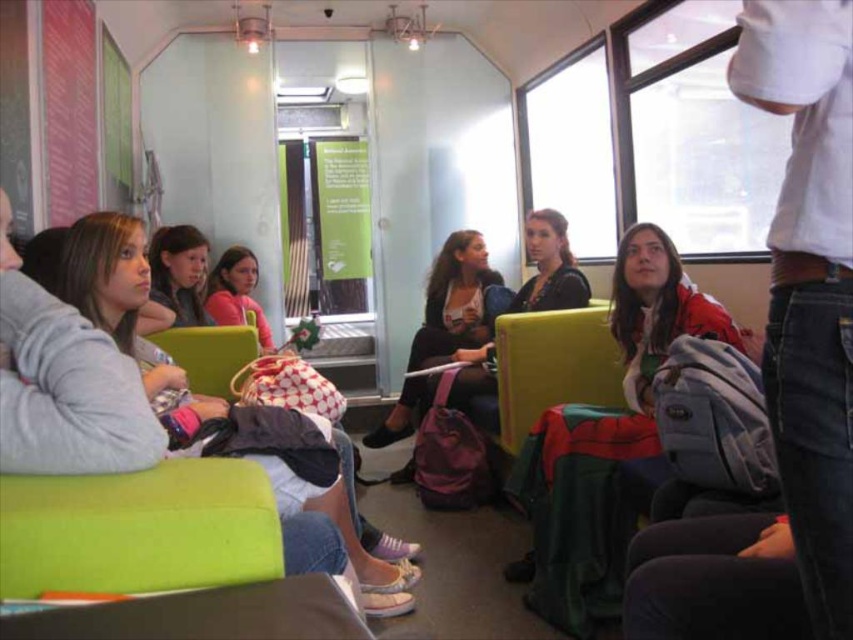
Is matte black backpack at center above matte green chair at center?

Yes.

Does matte black backpack at center appear under matte green chair at center?

Actually, matte black backpack at center is above matte green chair at center.

Who is more distant from viewer, (444, 296) or (202, 384)?

Positioned behind is point (444, 296).

Locate an element on the screen. matte black backpack at center is located at coordinates (457, 305).

Between point (154, 284) and point (196, 372), which one is positioned behind?

The point (154, 284) is behind.

Between point (181, 285) and point (241, 328), which one is positioned in front?

Point (241, 328) is in front.

Find the location of a particular element. This screenshot has width=853, height=640. matte black jacket at upper left is located at coordinates (177, 275).

Who is lower down, matte gray hoodie at left or matte black backpack at center?

matte gray hoodie at left is below.

Between matte gray hoodie at left and matte black backpack at center, which one appears on the right side from the viewer's perspective?

Positioned to the right is matte black backpack at center.

Image resolution: width=853 pixels, height=640 pixels. What do you see at coordinates (114, 285) in the screenshot?
I see `matte gray hoodie at left` at bounding box center [114, 285].

You are a GUI agent. You are given a task and a screenshot of the screen. Output one action in this format:
    pyautogui.click(x=<x>, y=<y>)
    Task: Click on the matte gray hoodie at left
    
    Given the screenshot: What is the action you would take?
    114,285